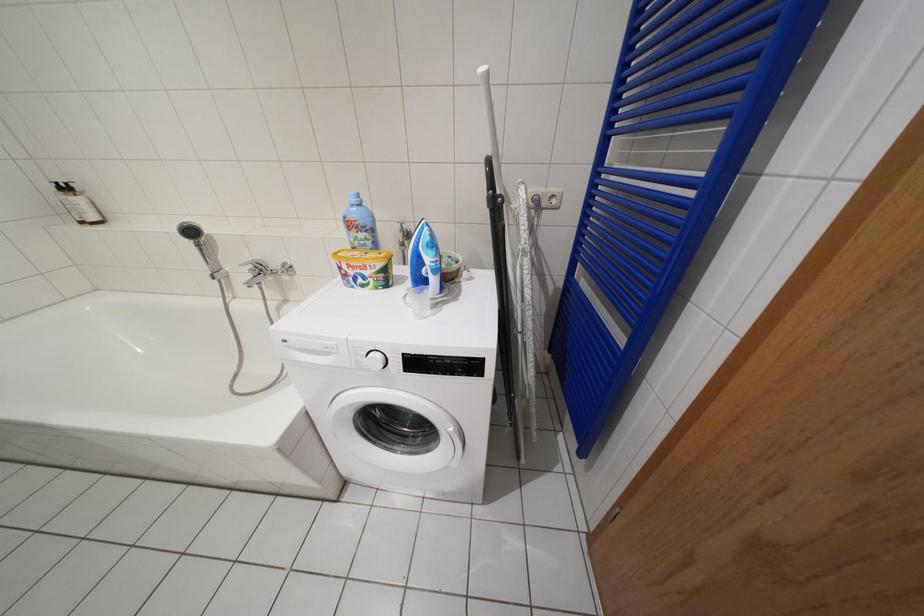
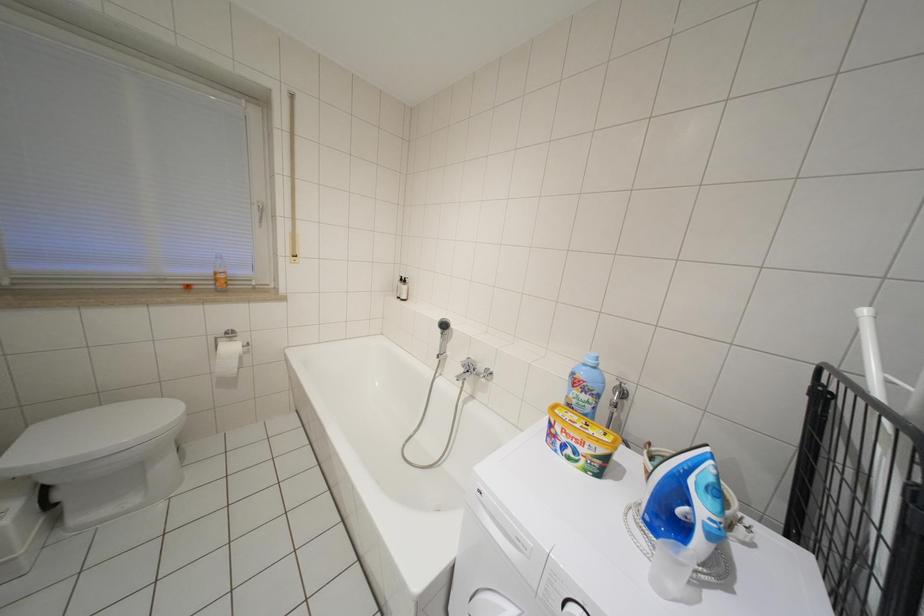
Question: Based on the continuous images, in which direction is the camera rotating? Reply with the corresponding letter.

Choices:
 (A) Left
 (B) Right
 (C) Up
 (D) Down

Answer: (A)